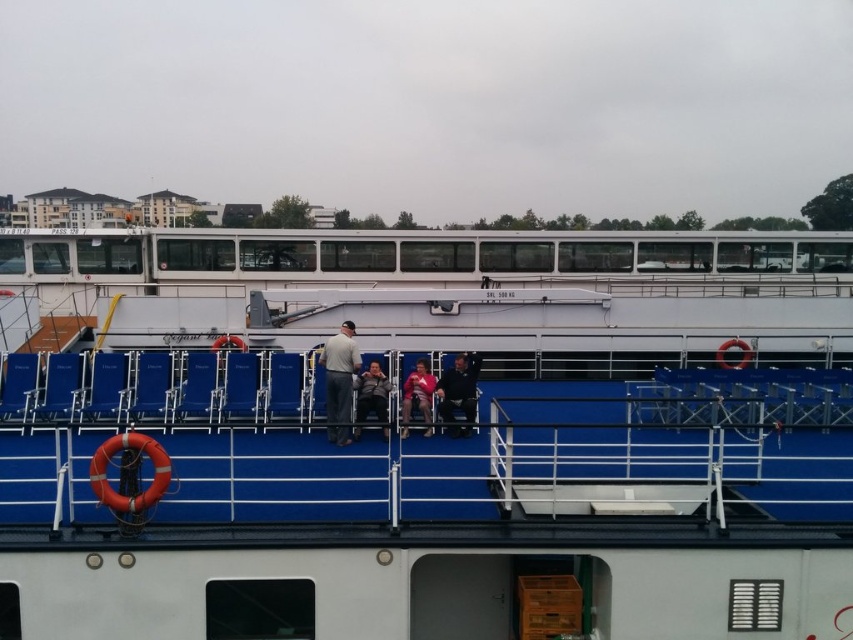
Question: Can you confirm if blue plastic chairs at center is smaller than dark gray fabric jacket at center?

Choices:
 (A) yes
 (B) no

Answer: (B)

Question: Which of the following is the farthest from the observer?

Choices:
 (A) (467, 378)
 (B) (358, 404)

Answer: (B)

Question: Is the position of light gray fabric jacket at center more distant than that of matte black jacket at center?

Choices:
 (A) yes
 (B) no

Answer: (B)

Question: Does light gray fabric jacket at center appear on the right side of dark gray fabric jacket at center?

Choices:
 (A) no
 (B) yes

Answer: (A)

Question: Among these points, which one is nearest to the camera?

Choices:
 (A) (328, 433)
 (B) (397, 595)

Answer: (B)

Question: Which of the following is the farthest from the observer?

Choices:
 (A) light gray fabric jacket at center
 (B) blue plastic chairs at center

Answer: (A)